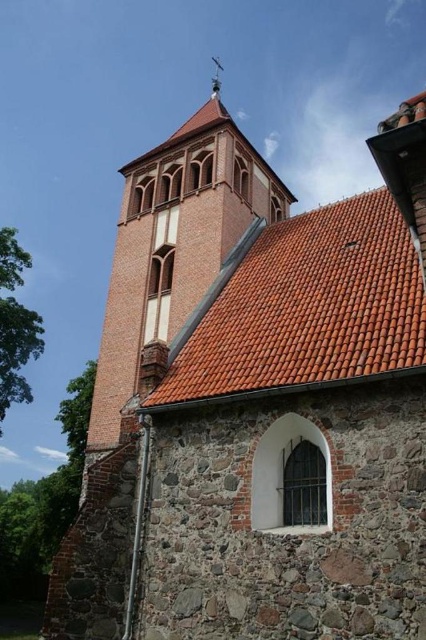
Is the position of orange clay tiles at upper center more distant than that of metallic spire at upper center?

No, it is in front of metallic spire at upper center.

Does orange clay tiles at upper center lie in front of metallic spire at upper center?

That is True.

In order to click on orange clay tiles at upper center in this screenshot , I will do `click(310, 307)`.

Can you confirm if light brown stone tower at center is positioned to the left of metallic spire at upper center?

Incorrect, light brown stone tower at center is not on the left side of metallic spire at upper center.

At what (x,y) coordinates should I click in order to perform the action: click on light brown stone tower at center. Please return your answer as a coordinate pair (x, y). This screenshot has height=640, width=426. Looking at the image, I should click on (175, 244).

Find the location of a particular element. This screenshot has height=640, width=426. light brown stone tower at center is located at coordinates (175, 244).

Is orange clay tiles at upper center positioned behind light brown stone tower at center?

No, orange clay tiles at upper center is in front of light brown stone tower at center.

Can you confirm if orange clay tiles at upper center is bigger than light brown stone tower at center?

No.

Image resolution: width=426 pixels, height=640 pixels. In order to click on orange clay tiles at upper center in this screenshot , I will do `click(310, 307)`.